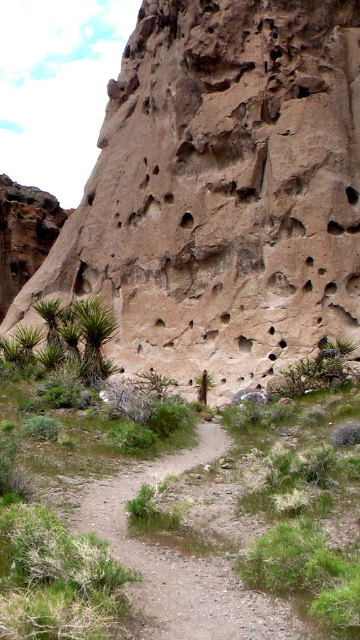
You are a hiker trying to navigate the path. The brown rough rock at center and the green spiky plant at lower left are in your way. Which object is bigger and might block your path more?

The brown rough rock at center is larger in size compared to the green spiky plant at lower left, so it might block your path more.

You are a hiker planning to cross the dirt path at center. There is a brown rough rock at center blocking your way. Can you walk around it on either side? Please explain based on the scene description.

The brown rough rock at center is taller than the dirt path at center, which suggests the rock is elevated above the path. Since the path is at center and the rock is blocking the way, you can likely walk around it on either side along the dirt path at center since the path is narrow and the rock is centrally located.